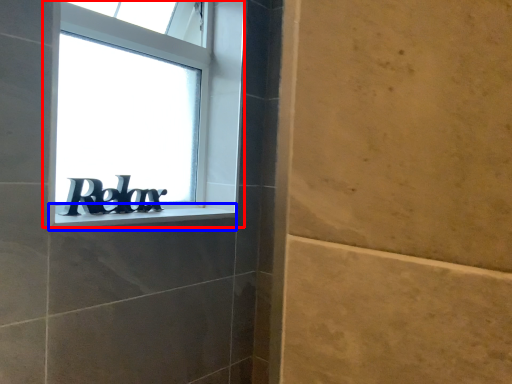
Question: Which object is further to the camera taking this photo, window (highlighted by a red box) or window sill (highlighted by a blue box)?

Choices:
 (A) window
 (B) window sill

Answer: (A)